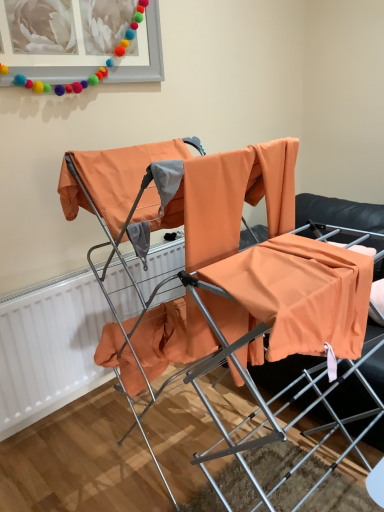
Question: Is matte gray picture frame at upper left bigger or smaller than orange fabric chair at center?

Choices:
 (A) big
 (B) small

Answer: (B)

Question: In terms of width, does matte gray picture frame at upper left look wider or thinner when compared to orange fabric chair at center?

Choices:
 (A) thin
 (B) wide

Answer: (A)

Question: Estimate the real-world distances between objects in this image. Which object is farther from the orange fabric chair at center?

Choices:
 (A) white matte radiator at left
 (B) matte gray picture frame at upper left

Answer: (B)

Question: Which object is the closest to the matte gray picture frame at upper left?

Choices:
 (A) white matte radiator at left
 (B) orange fabric chair at center

Answer: (B)